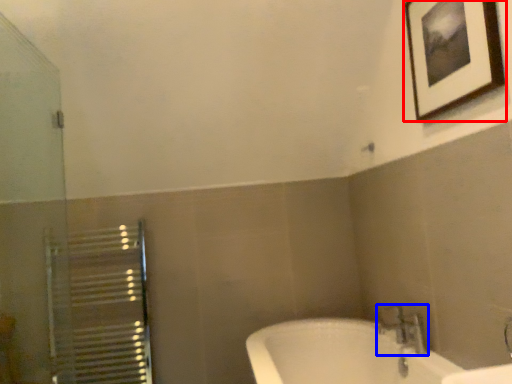
Question: Among these objects, which one is nearest to the camera, picture frame (highlighted by a red box) or tap (highlighted by a blue box)?

Choices:
 (A) picture frame
 (B) tap

Answer: (A)